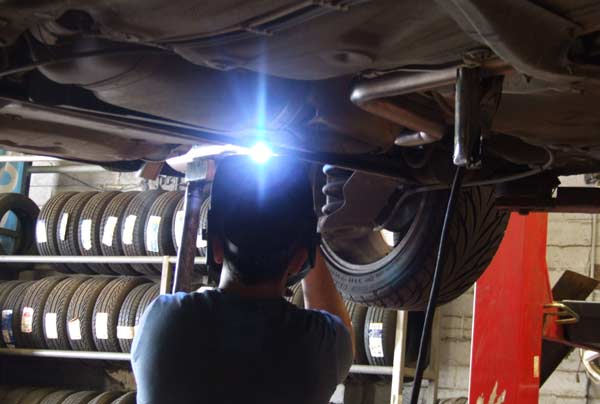
I want to click on light, so click(260, 152).